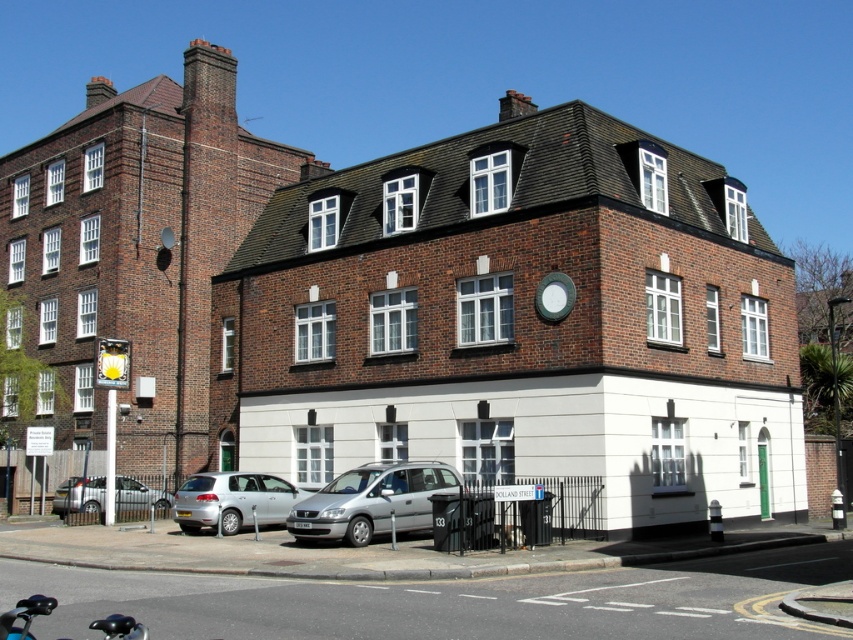
From the picture: You are a delivery driver who needs to park your vehicle between the silver metallic hatchback at lower left and the blue matte motorcycle at lower left. Is there enough space for your vehicle that is 4 meters long?

The silver metallic hatchback at lower left is to the left of the blue matte motorcycle at lower left, but the distance between them isn answer provided in the Objects Description. Without knowing the exact spacing, it is impossible to determine if there is sufficient room for a 4 meter vehicle. Please check the actual distance before attempting to park.

You are standing 20 meters away from the corner building. You see a silver metallic van at center. Can you determine if the van is closer to you than the building?

The silver metallic van at center is 25.13 meters away from the viewer, which is farther than your current position of 20 meters from the building. Therefore, the van is not closer to you than the building.

You are a delivery person trying to park your vehicle in the parking lot near the corner building. The parking spot is between the silver metallic van at center and the blue matte motorcycle at lower left. Which vehicle is shorter so you can park without hitting the building?

The silver metallic van at center is not as tall as the blue matte motorcycle at lower left, so parking near the van would be safer to avoid hitting the building.